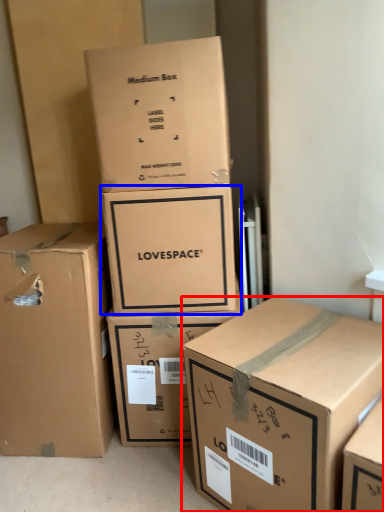
Question: Which object is further to the camera taking this photo, box (highlighted by a red box) or box (highlighted by a blue box)?

Choices:
 (A) box
 (B) box

Answer: (B)